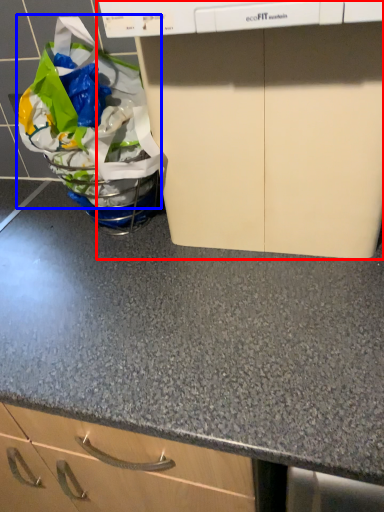
Question: Among these objects, which one is nearest to the camera, home appliance (highlighted by a red box) or grocery bag (highlighted by a blue box)?

Choices:
 (A) home appliance
 (B) grocery bag

Answer: (A)